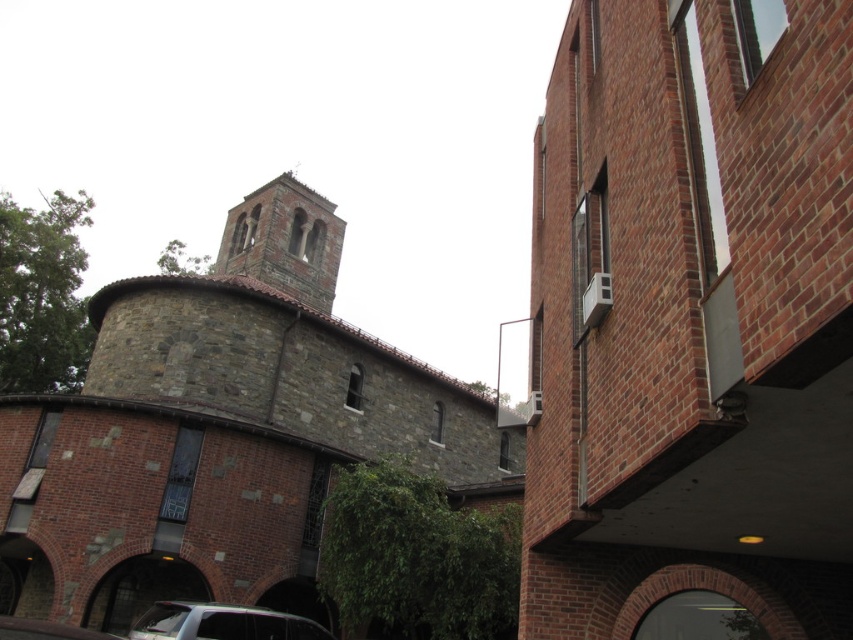
You are standing in front of the scene described. You want to take a photo of the brick building at right. Considering your camera has a maximum focus range of 10 meters, will you be able to capture it clearly?

The brick building at right is 9.57 meters away from the viewer, which is within the camera maximum focus range of 10 meters. Yes, you can capture it clearly.

You are a photographer planning to capture a wide shot of the stone church at center and the metallic silver car at lower left. Based on their sizes in the image, which one would appear larger in the photo?

The stone church at center is much taller than the metallic silver car at lower left, so it would appear larger in the photo.